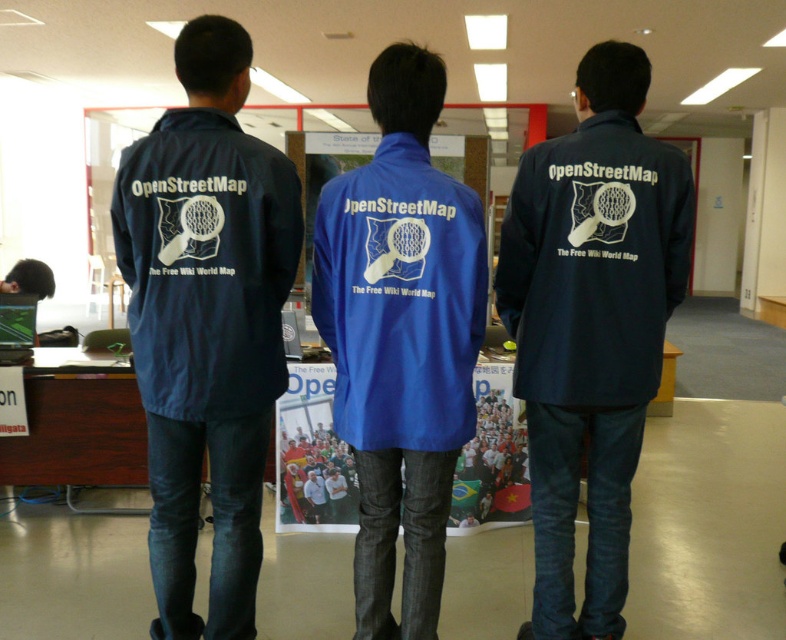
You are standing in the room and want to find the navy blue jacket at left. What are the coordinates where you should look?

The navy blue jacket at left is located at coordinates point (206, 323).

You are standing in the room where the OpenStreetMap group is. You want to move to a specific point marked at coordinates point (406,72). If you are currently 10 feet away from that point, how much closer do you need to get to reach it?

The distance of point (406,72) from viewer is 6.33 feet. Since you are currently 10 feet away, you need to move 3.67 feet closer to reach it.

In the scene shown: You are a photographer taking a group photo of the two people wearing navy blue jackets. You want to ensure both jackets are fully visible in the photo. Since the navy blue jacket at left is shorter than the navy blue jacket at center, which jacket should you focus on to avoid cropping the bottom of the jackets?

You should focus on the navy blue jacket at center since it is taller than the navy blue jacket at left. By framing the photo to include the full length of the taller jacket, the shorter jacket at left will also be fully visible.